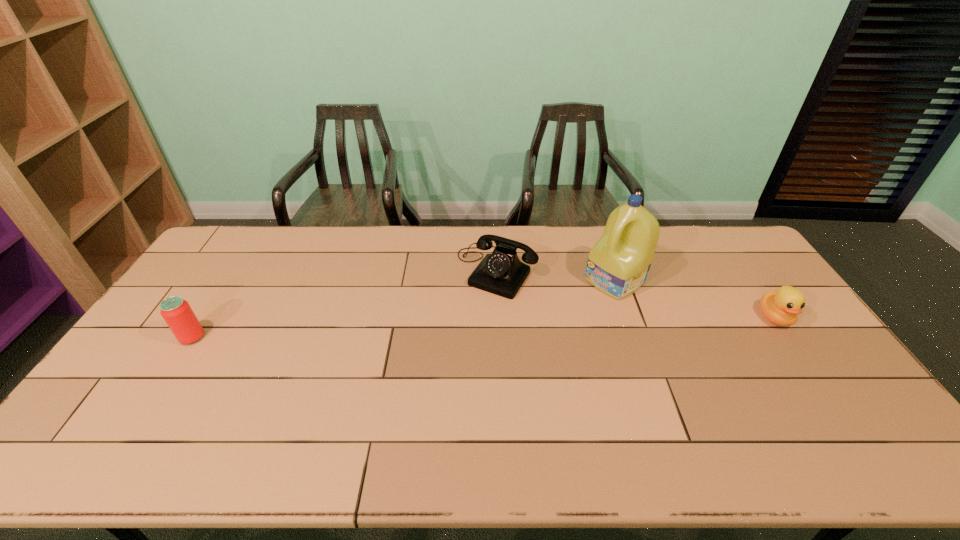
You are a GUI agent. You are given a task and a screenshot of the screen. Output one action in this format:
    pyautogui.click(x=<x>, y=<y>)
    Task: Click on the free spot on the desktop that is between the leftmost object and the duckling and is positioned on the label of the tallest object
    Image resolution: width=960 pixels, height=540 pixels.
    Given the screenshot: What is the action you would take?
    pyautogui.click(x=549, y=325)

Image resolution: width=960 pixels, height=540 pixels. I want to click on free space on the desktop that is between the leftmost object and the duckling and is positioned on the front face of the second object from left to right, so click(455, 328).